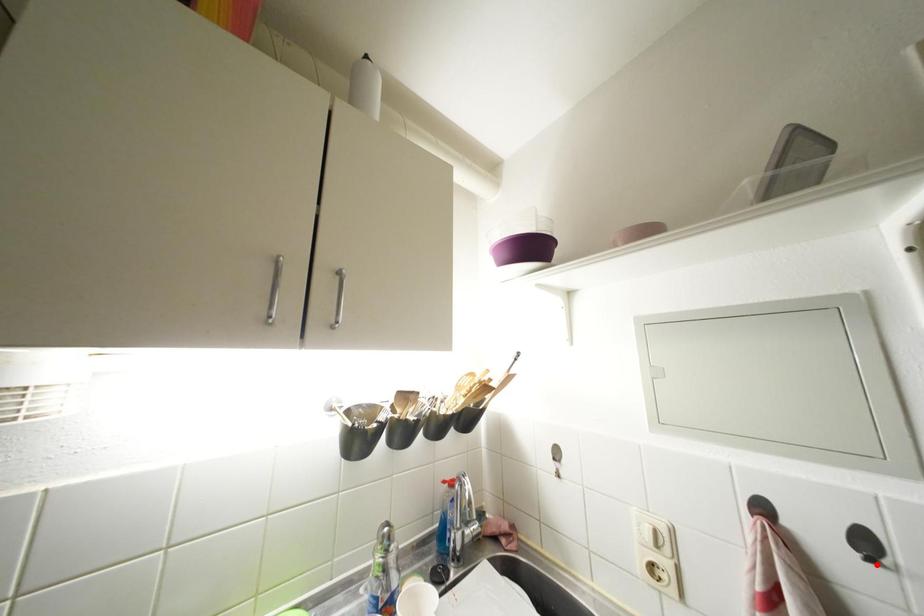
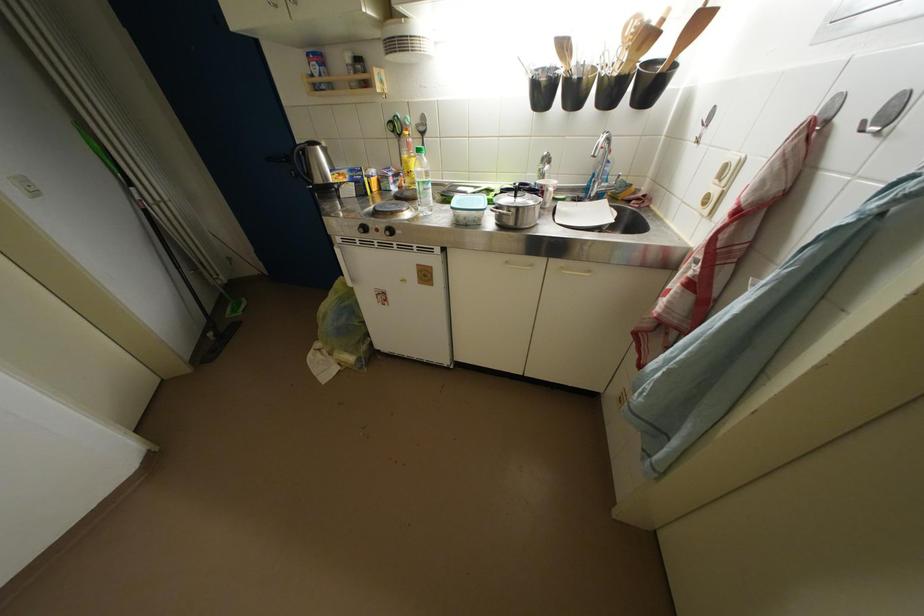
Question: I am providing you with two images of the same scene from different viewpoints. Image1 has a red point marked. In image2, the corresponding 3D location appears at what relative position? Reply with the corresponding letter.

Choices:
 (A) Closer
 (B) Farther

Answer: (B)